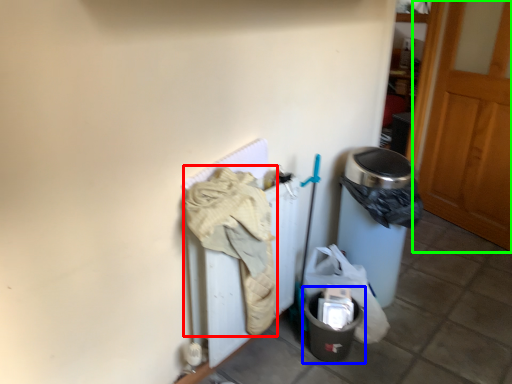
Question: Which object is the farthest from clothing (highlighted by a red box)? Choose among these: recycling bin (highlighted by a blue box) or door (highlighted by a green box).

Choices:
 (A) recycling bin
 (B) door

Answer: (B)